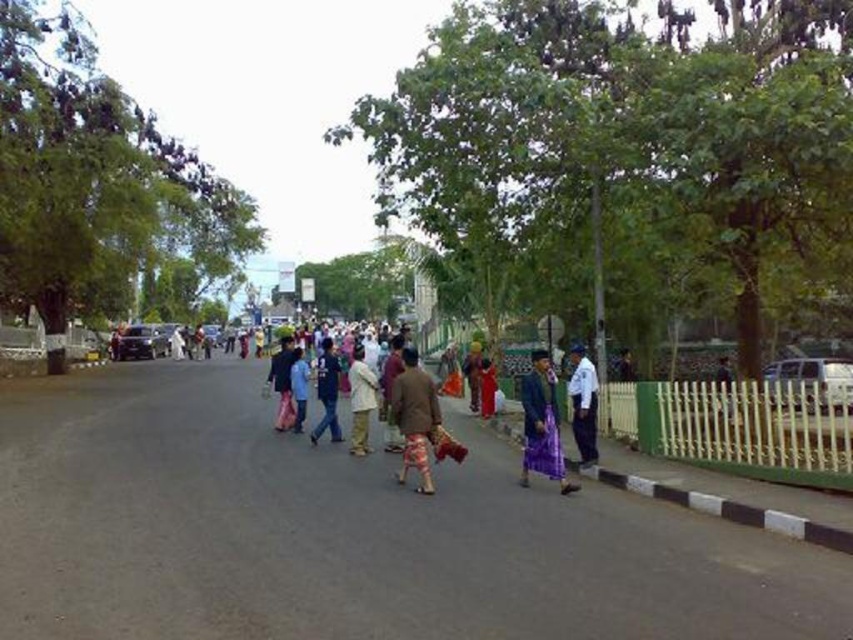
Question: Which is farther from the light brown fabric pants at center?

Choices:
 (A) white smooth uniform at right
 (B) brown woven cloth at center
 (C) blue fabric shirt at center
 (D) purple woven skirt at center

Answer: (A)

Question: Does brown woven cloth at center have a smaller size compared to light brown fabric pants at center?

Choices:
 (A) no
 (B) yes

Answer: (B)

Question: Which object is closer to the camera taking this photo?

Choices:
 (A) light brown fabric pants at center
 (B) purple woven skirt at center
 (C) white smooth uniform at right

Answer: (B)

Question: Which point is closer to the camera?

Choices:
 (A) (367, 380)
 (B) (421, 404)
 (C) (575, 435)
 (D) (543, 424)

Answer: (D)

Question: Is brown woven cloth at center positioned behind white smooth uniform at right?

Choices:
 (A) yes
 (B) no

Answer: (B)

Question: Does light brown fabric pants at center appear on the right side of blue fabric shirt at center?

Choices:
 (A) no
 (B) yes

Answer: (B)